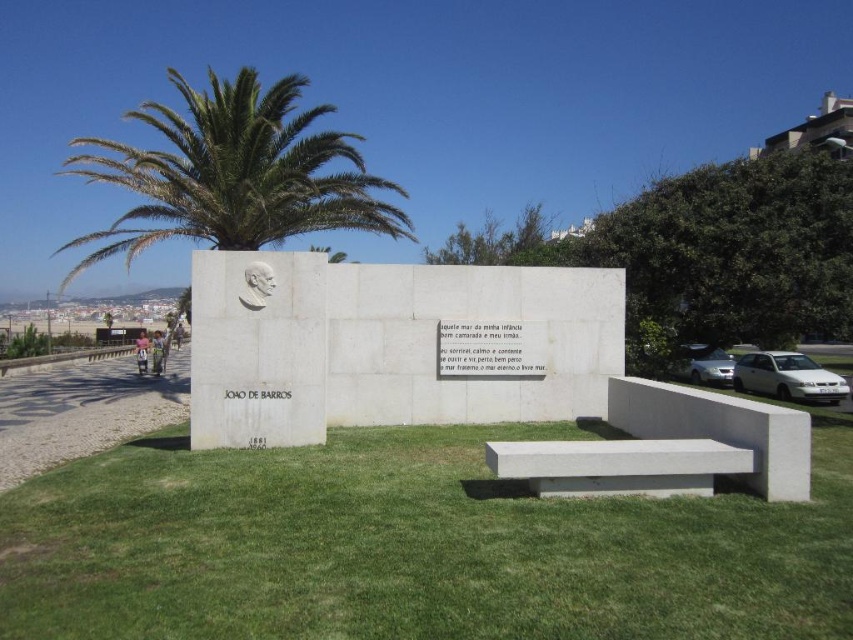
Question: Can you confirm if white concrete bench at center is positioned to the left of white concrete bench at lower center?

Choices:
 (A) yes
 (B) no

Answer: (B)

Question: Does green grass at center have a larger size compared to white concrete bench at lower center?

Choices:
 (A) no
 (B) yes

Answer: (A)

Question: Which point appears closest to the camera in this image?

Choices:
 (A) (294, 108)
 (B) (494, 452)

Answer: (B)

Question: Where is green leafy palm tree at upper left located in relation to white concrete bench at lower center in the image?

Choices:
 (A) right
 (B) left

Answer: (B)

Question: Which of the following is the closest to the observer?

Choices:
 (A) white concrete bench at center
 (B) green leafy palm tree at upper left

Answer: (A)

Question: Which object is the closest to the white concrete bench at center?

Choices:
 (A) white concrete bench at lower center
 (B) green leafy palm tree at upper left

Answer: (A)